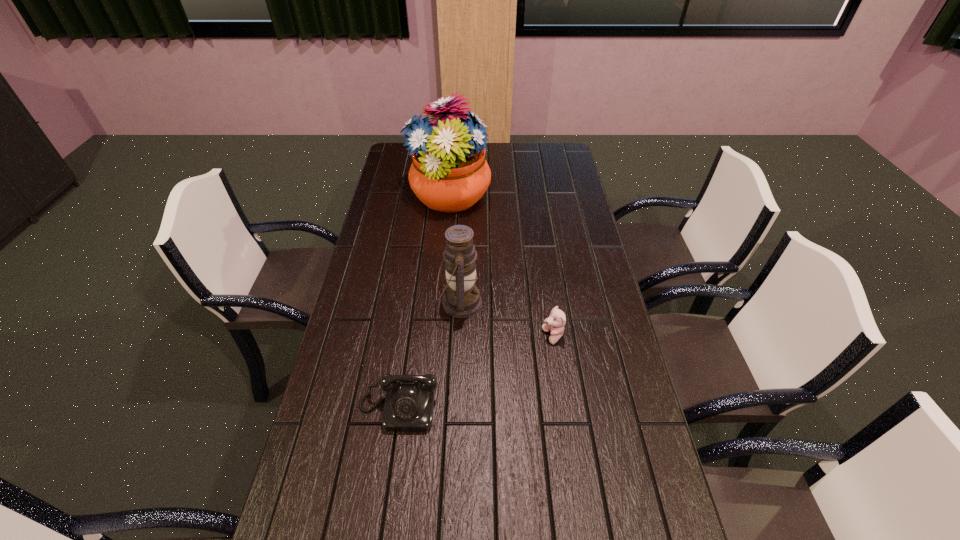
Locate an element on the screen. This screenshot has width=960, height=540. blank region between the third farthest object and the oil lamp is located at coordinates (507, 320).

You are a GUI agent. You are given a task and a screenshot of the screen. Output one action in this format:
    pyautogui.click(x=<x>, y=<y>)
    Task: Click on the vacant point located between the rightmost object and the tallest object
    The image size is (960, 540).
    Given the screenshot: What is the action you would take?
    pyautogui.click(x=501, y=267)

Identify the location of free space between the telephone and the teddy bear. (476, 372).

I want to click on the closest object to the third farthest object, so click(x=461, y=299).

I want to click on the closest object to the second nearest object, so click(461, 299).

At what (x,y) coordinates should I click in order to perform the action: click on vacant point that satisfies the following two spatial constraints: 1. at the face of the third farthest object; 2. on the dial of the nearest object. Please return your answer as a coordinate pair (x, y). Looking at the image, I should click on (564, 408).

The height and width of the screenshot is (540, 960). I want to click on free spot that satisfies the following two spatial constraints: 1. at the face of the third farthest object; 2. on the dial of the telephone, so click(x=564, y=408).